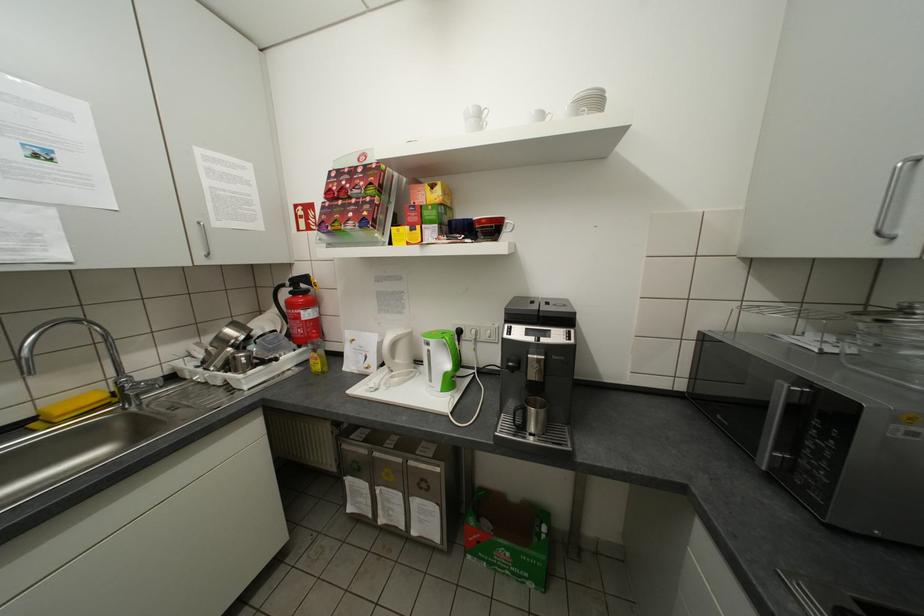
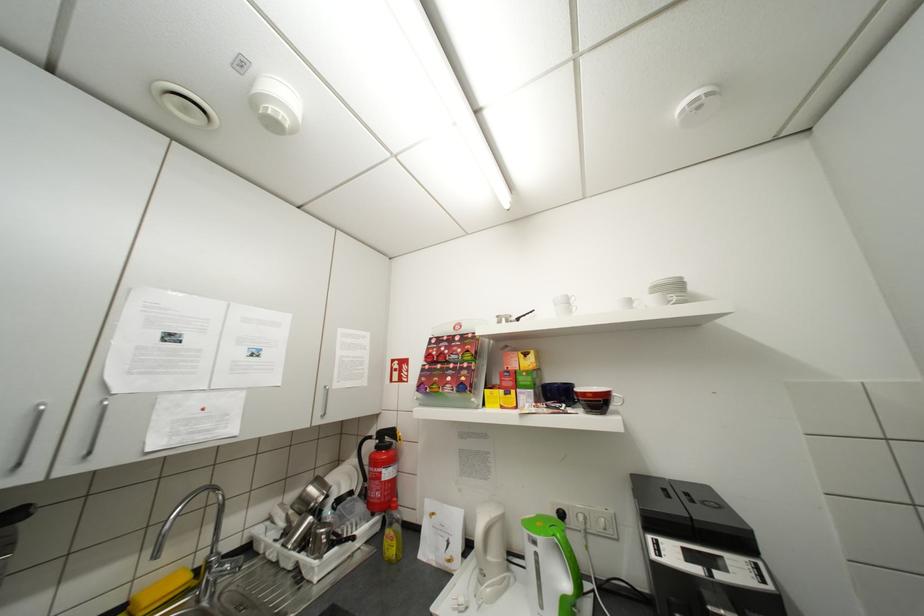
Looking at this image, in a continuous first-person perspective shot, in which direction is the camera moving?

The cameraman moved toward left, backward.